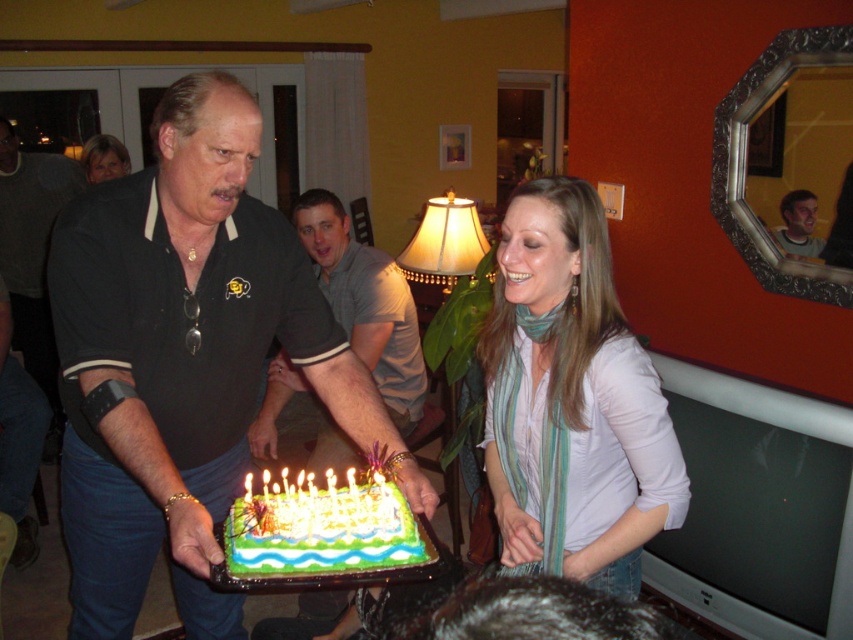
Question: Among these points, which one is farthest from the camera?

Choices:
 (A) (120, 452)
 (B) (114, 177)
 (C) (801, 204)

Answer: (C)

Question: Can you confirm if white striped scarf at center is thinner than blonde hair at upper left?

Choices:
 (A) no
 (B) yes

Answer: (A)

Question: Which point is farther from the camera taking this photo?

Choices:
 (A) (357, 504)
 (B) (813, 202)
 (C) (546, 493)

Answer: (B)

Question: Considering the relative positions of green frosted cake at center and blonde hair at upper left in the image provided, where is green frosted cake at center located with respect to blonde hair at upper left?

Choices:
 (A) below
 (B) above

Answer: (A)

Question: Which object is closer to the camera taking this photo?

Choices:
 (A) green frosted cake at center
 (B) white striped scarf at center
 (C) blonde hair at upper left

Answer: (A)

Question: Is light brown hair at upper right positioned at the back of blonde hair at upper left?

Choices:
 (A) no
 (B) yes

Answer: (A)